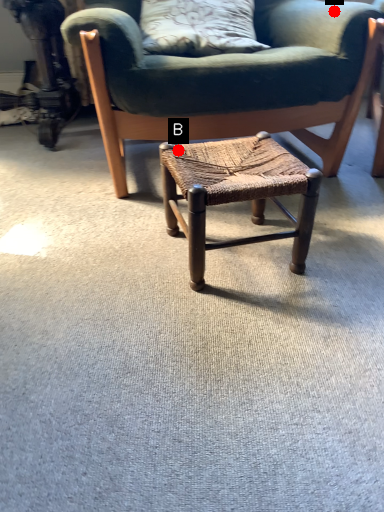
Question: Two points are circled on the image, labeled by A and B beside each circle. Which of the following is the closest to the observer?

Choices:
 (A) A is closer
 (B) B is closer

Answer: (B)